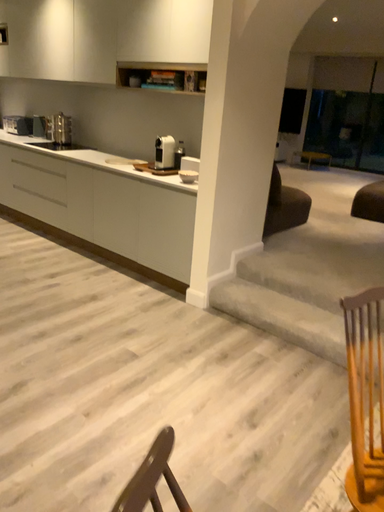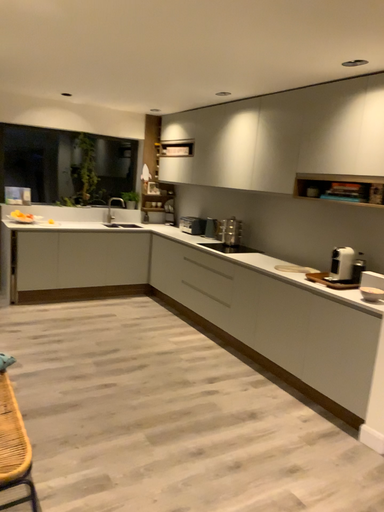
Question: Which way did the camera rotate in the video?

Choices:
 (A) rotated downward
 (B) rotated upward

Answer: (B)